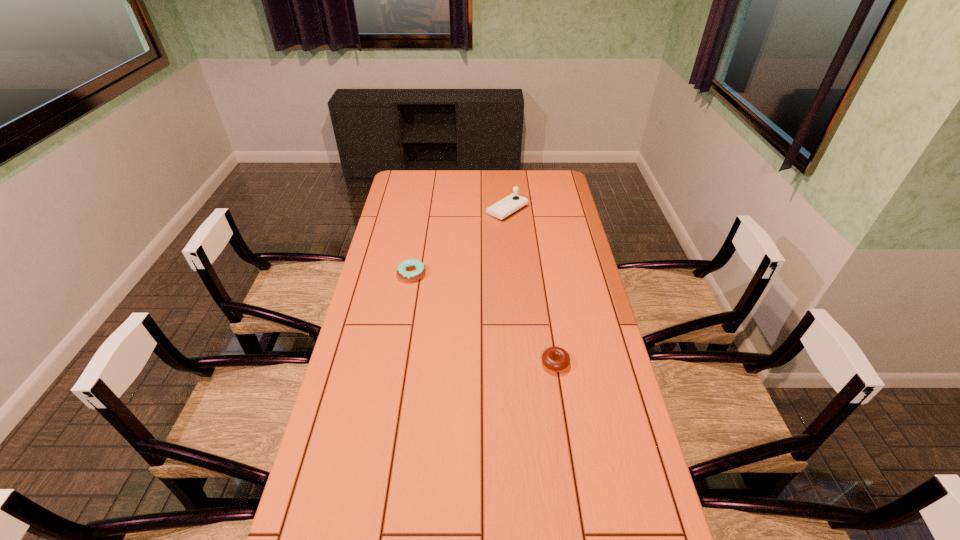
The height and width of the screenshot is (540, 960). Identify the location of the farthest object. pos(511,204).

The width and height of the screenshot is (960, 540). I want to click on joystick, so click(x=511, y=204).

Find the location of a particular element. the right doughnut is located at coordinates (556, 359).

The width and height of the screenshot is (960, 540). In order to click on the nearer doughnut in this screenshot , I will do `click(556, 359)`.

Locate an element on the screen. Image resolution: width=960 pixels, height=540 pixels. the leftmost object is located at coordinates (402, 268).

This screenshot has width=960, height=540. I want to click on the farther doughnut, so click(x=402, y=268).

Identify the location of free location located 0.190m on the right of the joystick. This screenshot has width=960, height=540. click(x=568, y=210).

Locate an element on the screen. The height and width of the screenshot is (540, 960). free region located on the right of the nearest object is located at coordinates (600, 363).

This screenshot has height=540, width=960. I want to click on vacant space located 0.290m on the right of the leftmost object, so click(499, 274).

Locate an element on the screen. The width and height of the screenshot is (960, 540). object that is at the left edge is located at coordinates (402, 268).